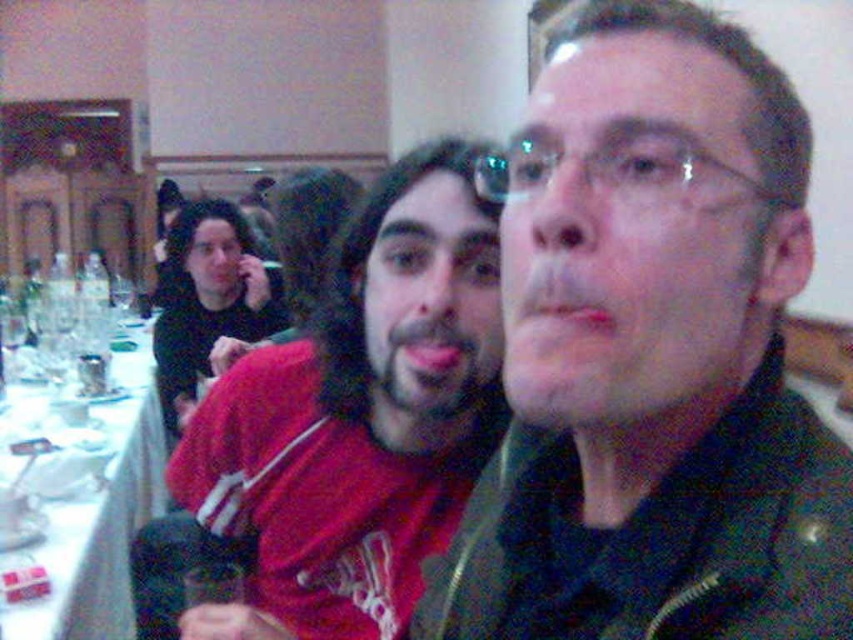
This screenshot has height=640, width=853. What do you see at coordinates (84, 499) in the screenshot?
I see `white glossy table at left` at bounding box center [84, 499].

Can you confirm if white glossy table at left is wider than transparent plastic glasses at center?

Yes.

What do you see at coordinates (84, 499) in the screenshot? The width and height of the screenshot is (853, 640). I see `white glossy table at left` at bounding box center [84, 499].

You are a GUI agent. You are given a task and a screenshot of the screen. Output one action in this format:
    pyautogui.click(x=<x>, y=<y>)
    Task: Click on the white glossy table at left
    Image resolution: width=853 pixels, height=640 pixels.
    Given the screenshot: What is the action you would take?
    pyautogui.click(x=84, y=499)

Which is in front, point (827, 548) or point (233, 218)?

Positioned in front is point (827, 548).

In the scene shown: Between matte black jacket at center and black matte shirt at center, which one is positioned lower?

matte black jacket at center is lower down.

Between point (532, 285) and point (241, 296), which one is positioned in front?

Point (532, 285) is in front.

Where is `matte black jacket at center`? This screenshot has width=853, height=640. matte black jacket at center is located at coordinates (653, 356).

What do you see at coordinates (653, 356) in the screenshot?
I see `matte black jacket at center` at bounding box center [653, 356].

Who is more distant from viewer, [657,365] or [477,202]?

Positioned behind is point [477,202].

Measure the distance between matte black jacket at center and camera.

They are 14.25 inches apart.

Where is `matte black jacket at center`? The image size is (853, 640). matte black jacket at center is located at coordinates (653, 356).